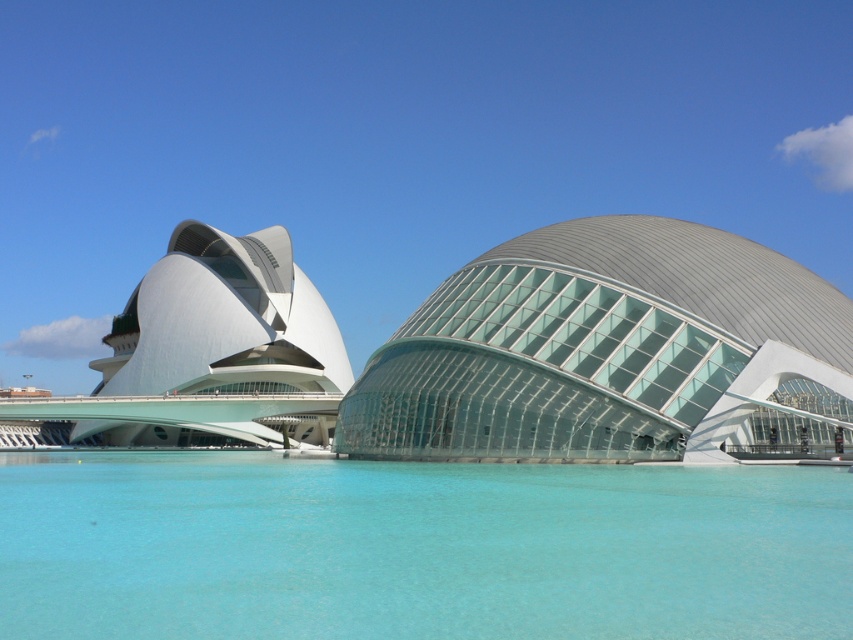
You are a photographer planning to capture the transparent glass dome at center and the clear blue water at lower center in a single shot. Based on their sizes, which object should you focus on to ensure both are visible without cropping?

The clear blue water at lower center is smaller than the transparent glass dome at center, so focusing on the transparent glass dome at center would allow the smaller clear blue water at lower center to fit into the frame without cropping.

You are an architect evaluating the two structures. Based on the scene, which object is shorter between the clear blue water at lower center and the transparent glass dome at center?

The clear blue water at lower center is not as tall as the transparent glass dome at center, so the clear blue water at lower center is shorter.